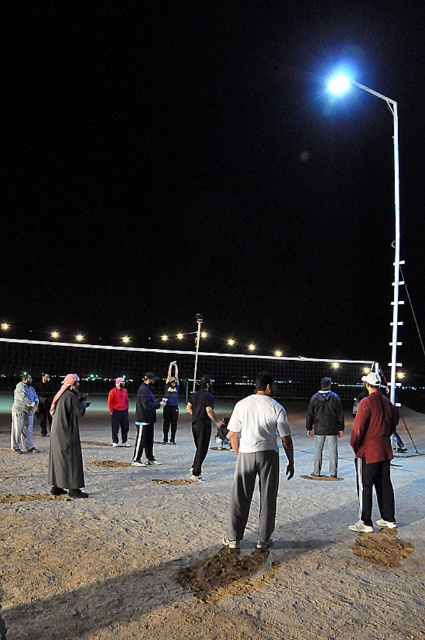
Can you confirm if dark gray fabric jacket at center is shorter than dark gray fabric jacket at left?

Yes.

Which is behind, point (136, 397) or point (42, 419)?

Positioned behind is point (136, 397).

This screenshot has height=640, width=425. Find the location of `dark gray fabric jacket at center`. dark gray fabric jacket at center is located at coordinates (146, 420).

Does dark gray jacket at center have a greater height compared to dark gray fabric jacket at center?

Correct, dark gray jacket at center is much taller as dark gray fabric jacket at center.

Is point (331, 465) positioned behind point (142, 404)?

No.

At what (x,y) coordinates should I click in order to perform the action: click on dark gray jacket at center. Please return your answer as a coordinate pair (x, y). Image resolution: width=425 pixels, height=640 pixels. Looking at the image, I should click on (325, 426).

Does white mesh net at center have a lesser width compared to white matte shirt at center?

In fact, white mesh net at center might be wider than white matte shirt at center.

Which is in front, point (121, 358) or point (261, 509)?

Point (261, 509)

Does point (39, 342) come behind point (271, 412)?

Yes, it is.

This screenshot has height=640, width=425. What are the coordinates of `white mesh net at center` in the screenshot? It's located at (90, 364).